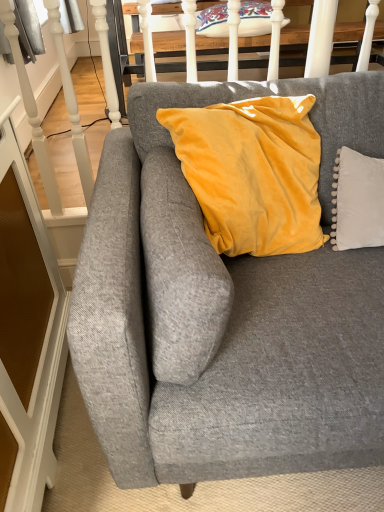
This screenshot has height=512, width=384. What are the coordinates of `velvet gray couch at center` in the screenshot? It's located at (232, 315).

What do you see at coordinates (232, 315) in the screenshot? I see `velvet gray couch at center` at bounding box center [232, 315].

You are a GUI agent. You are given a task and a screenshot of the screen. Output one action in this format:
    pyautogui.click(x=<x>, y=<y>)
    Task: Click on the velvet gray couch at center
    The width and height of the screenshot is (384, 512).
    Given the screenshot: What is the action you would take?
    pyautogui.click(x=232, y=315)